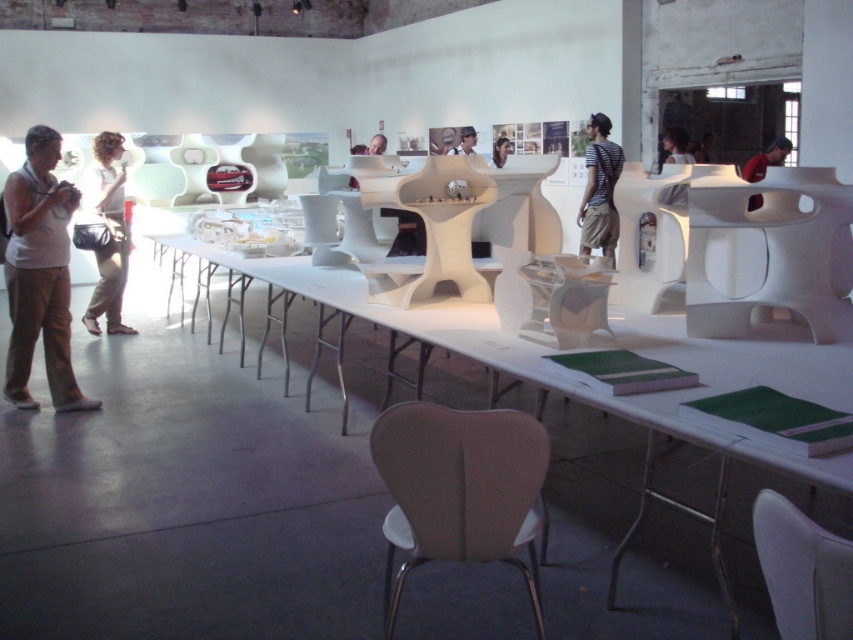
Question: Which of the following is the farthest from the observer?

Choices:
 (A) (757, 208)
 (B) (502, 150)
 (C) (471, 141)
 (D) (772, 566)

Answer: (B)

Question: In this image, where is striped t-shirt at center located relative to smooth white hair at center?

Choices:
 (A) left
 (B) right

Answer: (B)

Question: Estimate the real-world distances between objects in this image. Which object is closer to the white matte chair at upper center?

Choices:
 (A) smooth skin face at center
 (B) white matte chair at lower right
 (C) smooth white hair at center

Answer: (C)

Question: Among these points, which one is farthest from the camera?

Choices:
 (A) (791, 506)
 (B) (703, 150)
 (C) (473, 128)

Answer: (B)

Question: Does white cotton tank top at left appear under dark blue shirt at center?

Choices:
 (A) yes
 (B) no

Answer: (A)

Question: Is dark blue shirt at center below smooth white hair at center?

Choices:
 (A) no
 (B) yes

Answer: (A)